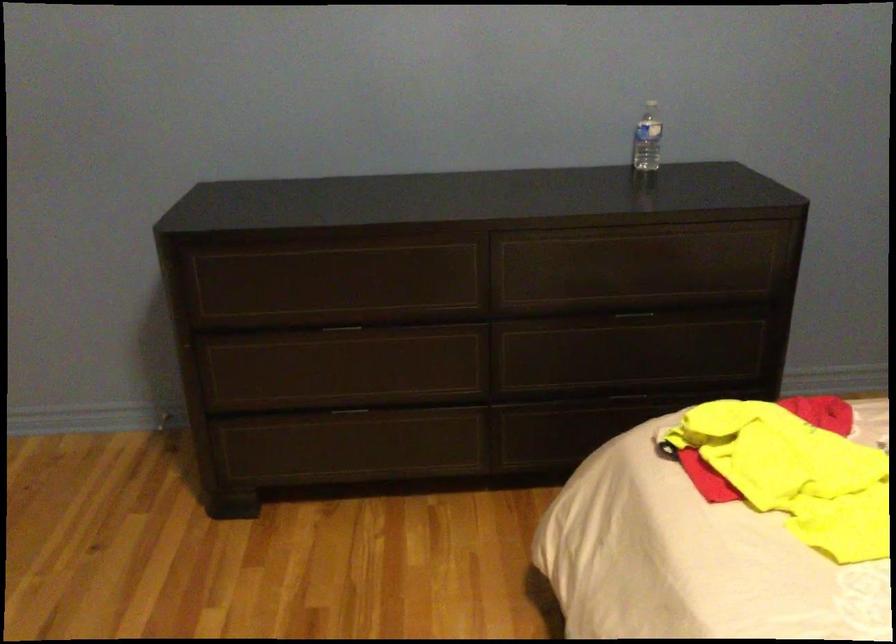
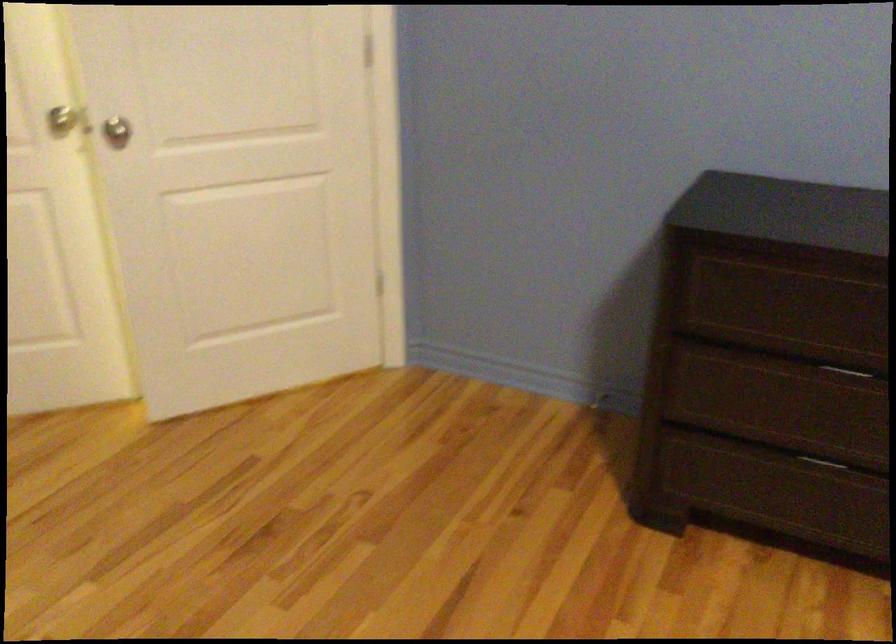
The point at (340, 413) is marked in the first image. Where is the corresponding point in the second image?

(821, 462)